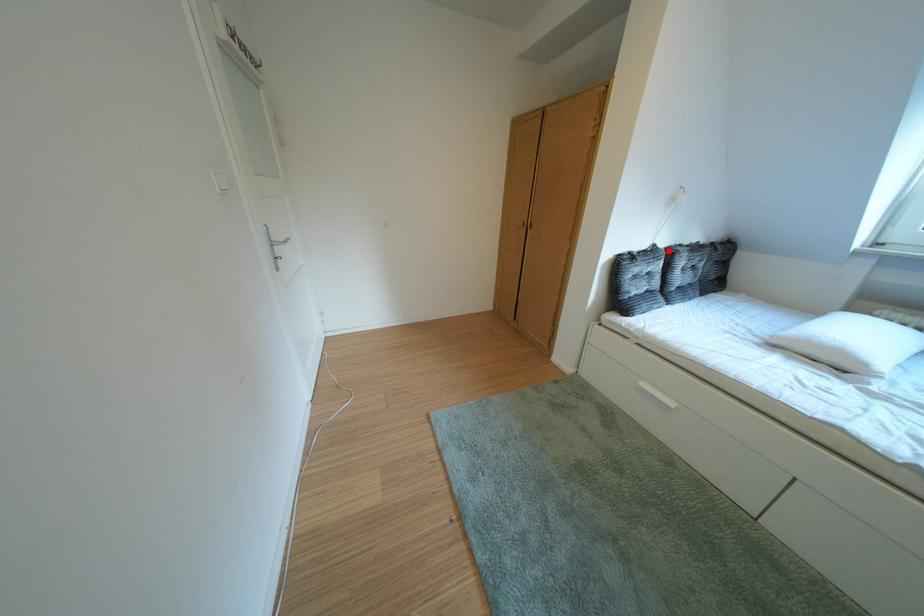
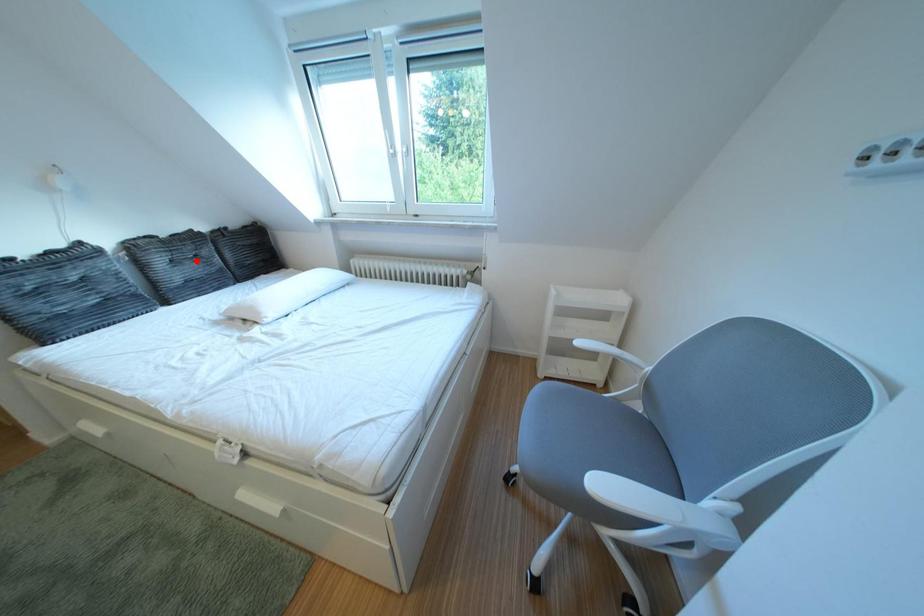
Based on the photo, I am providing you with two images of the same scene from different viewpoints. A red point is marked on the first image and another point is marked on the second image. Are the points marked in image1 and image2 representing the same 3D position?

No